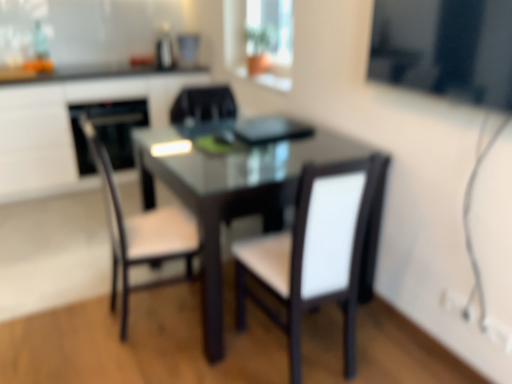
Image resolution: width=512 pixels, height=384 pixels. I want to click on free region under transparent glass window screen at upper right, marked as the second window screen in a top-to-bottom arrangement (from a real-world perspective), so click(x=397, y=334).